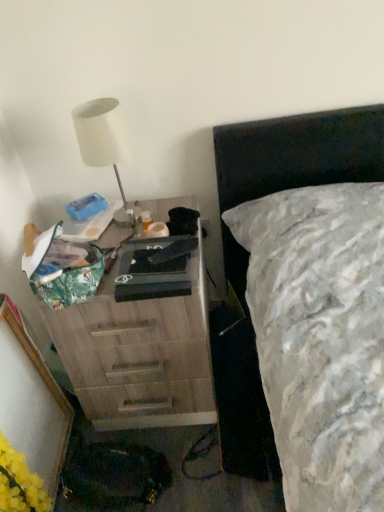
Question: Is wooden chest of drawers at left thinner than yellow matte flower at lower left?

Choices:
 (A) no
 (B) yes

Answer: (A)

Question: Considering the relative sizes of wooden chest of drawers at left and yellow matte flower at lower left in the image provided, is wooden chest of drawers at left smaller than yellow matte flower at lower left?

Choices:
 (A) yes
 (B) no

Answer: (B)

Question: Would you say wooden chest of drawers at left is a long distance from yellow matte flower at lower left?

Choices:
 (A) no
 (B) yes

Answer: (A)

Question: From the image's perspective, is wooden chest of drawers at left located above yellow matte flower at lower left?

Choices:
 (A) no
 (B) yes

Answer: (B)

Question: Considering the relative sizes of wooden chest of drawers at left and yellow matte flower at lower left in the image provided, is wooden chest of drawers at left bigger than yellow matte flower at lower left?

Choices:
 (A) yes
 (B) no

Answer: (A)

Question: Would you say yellow matte flower at lower left is to the left or to the right of white matte lamp at upper left in the picture?

Choices:
 (A) left
 (B) right

Answer: (A)

Question: Relative to white matte lamp at upper left, is yellow matte flower at lower left in front or behind?

Choices:
 (A) front
 (B) behind

Answer: (A)

Question: From a real-world perspective, relative to white matte lamp at upper left, is yellow matte flower at lower left vertically above or below?

Choices:
 (A) below
 (B) above

Answer: (A)

Question: From the image's perspective, is yellow matte flower at lower left positioned above or below white matte lamp at upper left?

Choices:
 (A) above
 (B) below

Answer: (B)

Question: Considering their positions, is wooden chest of drawers at left located in front of or behind yellow matte flower at lower left?

Choices:
 (A) front
 (B) behind

Answer: (B)

Question: Considering the positions of wooden chest of drawers at left and yellow matte flower at lower left in the image, is wooden chest of drawers at left wider or thinner than yellow matte flower at lower left?

Choices:
 (A) thin
 (B) wide

Answer: (B)

Question: From a real-world perspective, relative to yellow matte flower at lower left, is wooden chest of drawers at left vertically above or below?

Choices:
 (A) above
 (B) below

Answer: (A)

Question: In terms of size, does wooden chest of drawers at left appear bigger or smaller than yellow matte flower at lower left?

Choices:
 (A) small
 (B) big

Answer: (B)

Question: Looking at their shapes, would you say white matte lamp at upper left is wider or thinner than wooden chest of drawers at left?

Choices:
 (A) thin
 (B) wide

Answer: (A)

Question: Is white matte lamp at upper left in front of or behind wooden chest of drawers at left in the image?

Choices:
 (A) behind
 (B) front

Answer: (A)